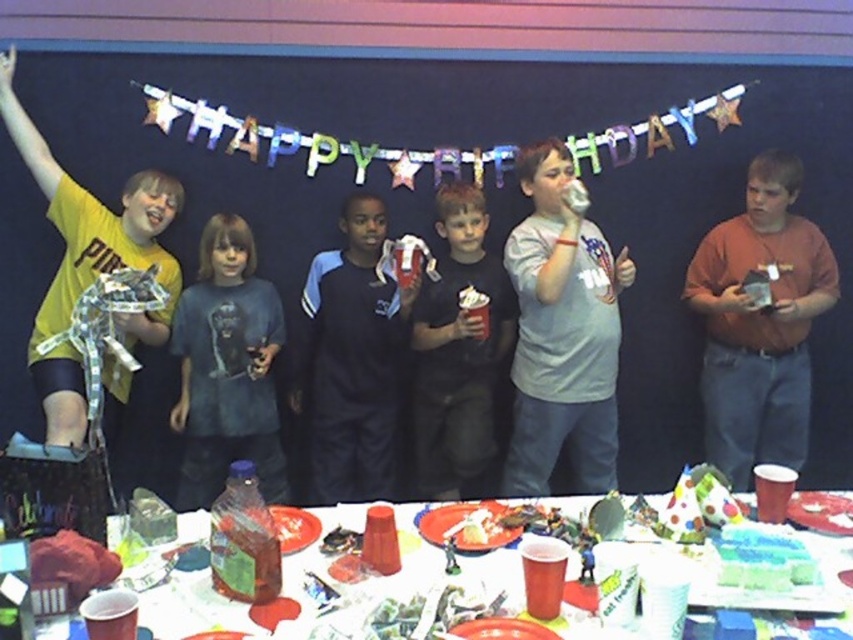
You are taking a photo of the birthday party scene. You notice two points marked in the image at coordinates point (724, 374) and point (335, 257). Which point is closer to the camera?

Point (724, 374) is further to the camera than point (335, 257), so the closer point to the camera is point (335, 257).

You are a photographer at the birthday party. You want to take a group photo of the children wearing the brown cotton shirt at right and the dark blue jersey at center. Since you want to make sure both shirts are visible in the photo, which child should you ask to move closer to the camera?

The brown cotton shirt at right is larger in size than the dark blue jersey at center, so the child wearing the dark blue jersey at center should move closer to the camera to ensure both shirts are visible.